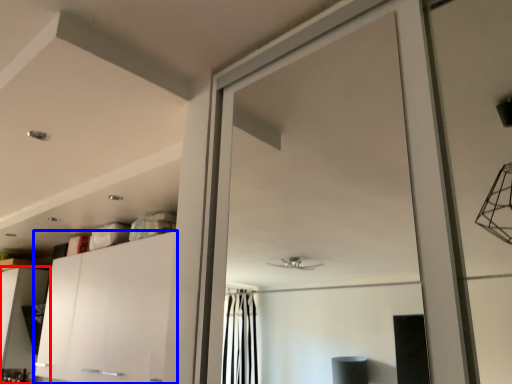
Question: Which point is closer to the camera, cabinetry (highlighted by a red box) or cabinetry (highlighted by a blue box)?

Choices:
 (A) cabinetry
 (B) cabinetry

Answer: (B)